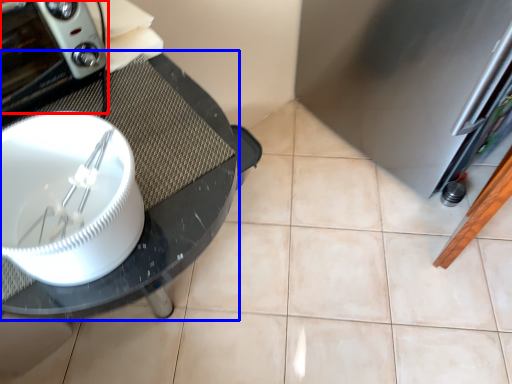
Question: Which object is further to the camera taking this photo, home appliance (highlighted by a red box) or glass table (highlighted by a blue box)?

Choices:
 (A) home appliance
 (B) glass table

Answer: (B)